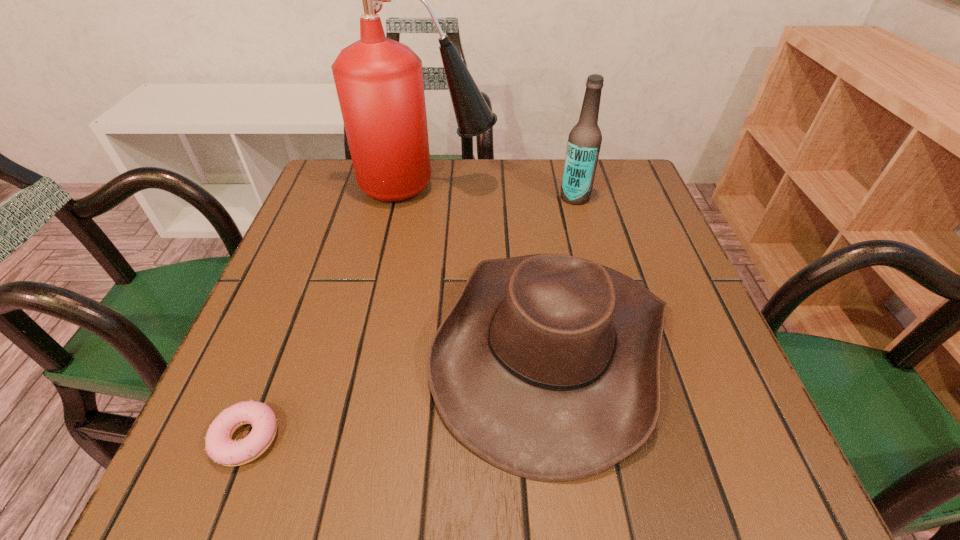
Where is `vacant space in between the shortest object and the second shortest object`? The width and height of the screenshot is (960, 540). vacant space in between the shortest object and the second shortest object is located at coordinates (399, 392).

Locate an element on the screen. The height and width of the screenshot is (540, 960). free spot between the fire extinguisher and the doughnut is located at coordinates (336, 313).

At what (x,y) coordinates should I click in order to perform the action: click on vacant space that's between the tallest object and the doughnut. Please return your answer as a coordinate pair (x, y). Looking at the image, I should click on (336, 313).

Where is `free space between the cowboy hat and the doughnut`? The image size is (960, 540). free space between the cowboy hat and the doughnut is located at coordinates (399, 392).

The image size is (960, 540). In order to click on free space between the shortest object and the third tallest object in this screenshot , I will do `click(399, 392)`.

Where is `free space between the doughnut and the fire extinguisher`? The image size is (960, 540). free space between the doughnut and the fire extinguisher is located at coordinates coord(336,313).

The image size is (960, 540). In order to click on empty location between the third shortest object and the tallest object in this screenshot , I will do `click(500, 192)`.

Identify which object is located as the second nearest to the third shortest object. Please provide its 2D coordinates. Your answer should be formatted as a tuple, i.e. [(x, y)], where the tuple contains the x and y coordinates of a point satisfying the conditions above.

[(547, 366)]

Locate an element on the screen. the third closest object to the doughnut is located at coordinates [584, 142].

Locate an element on the screen. vacant region that satisfies the following two spatial constraints: 1. with the nozzle aimed from the fire extinguisher; 2. on the right side of the second shortest object is located at coordinates (400, 345).